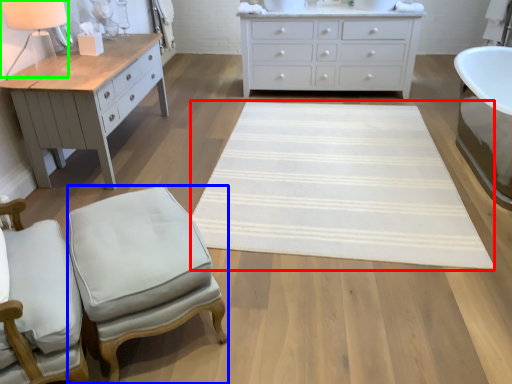
Question: Which is farther away from mat (highlighted by a red box)? stool (highlighted by a blue box) or table lamp (highlighted by a green box)?

Choices:
 (A) stool
 (B) table lamp

Answer: (B)